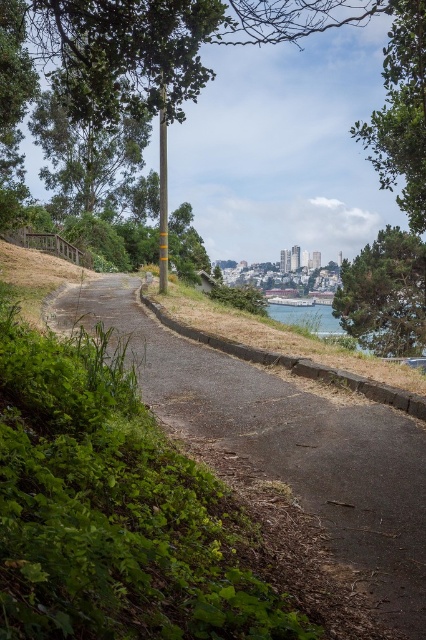
You are standing on the paved pathway and see the green leafy tree at left and the green textured tree at right. Which tree is closer to your left side?

The green leafy tree at left is closer to your left side because it is positioned on the left side of the green textured tree at right.

You are a gardener planning to plant a new tree between the green leafy tree at left and the green textured tree at right. Based on their widths, which tree should you consider for spacing adjustments to ensure enough room?

The green leafy tree at left might be wider than the green textured tree at right, so you should consider spacing adjustments around the green leafy tree at left to ensure sufficient room.